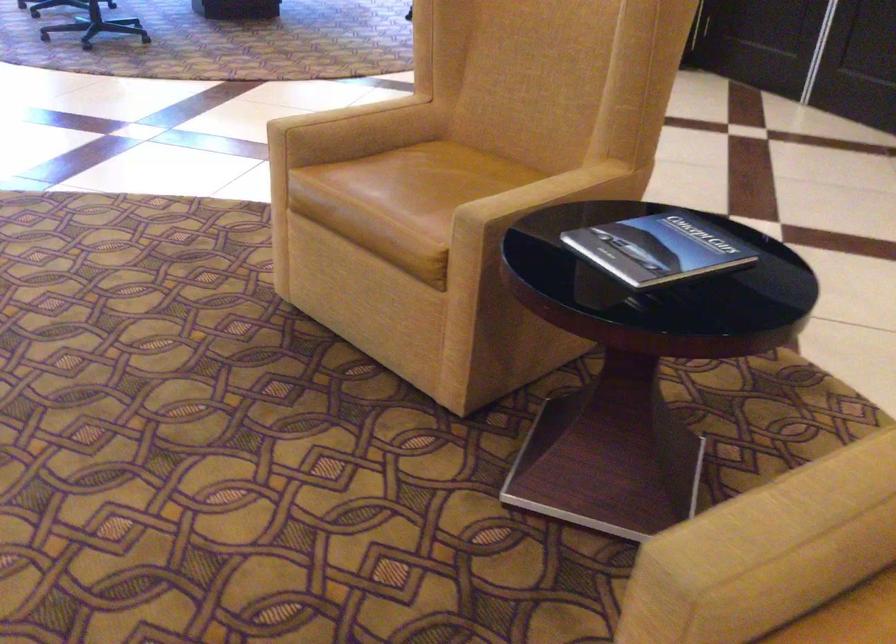
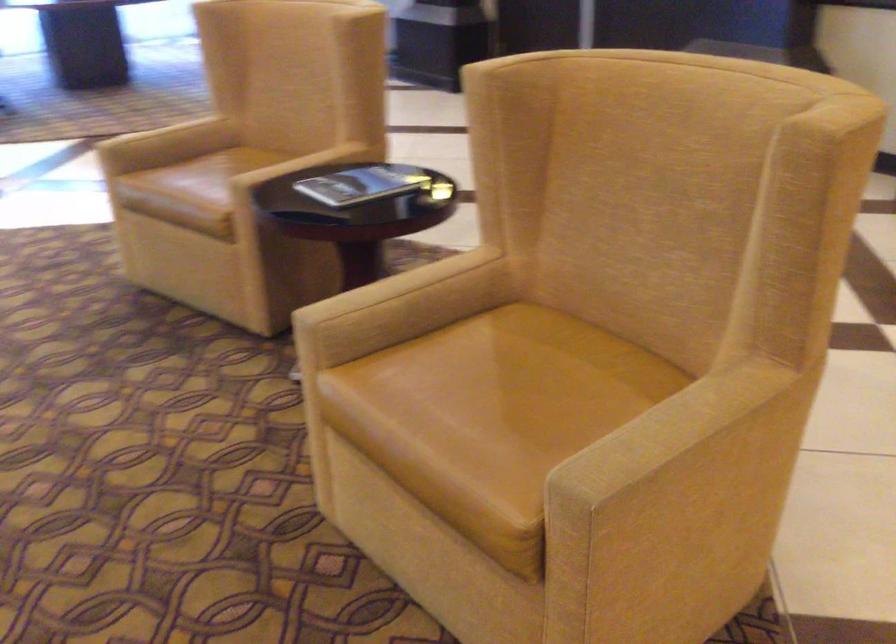
In the second image, find the point that corresponds to point (652, 245) in the first image.

(363, 184)